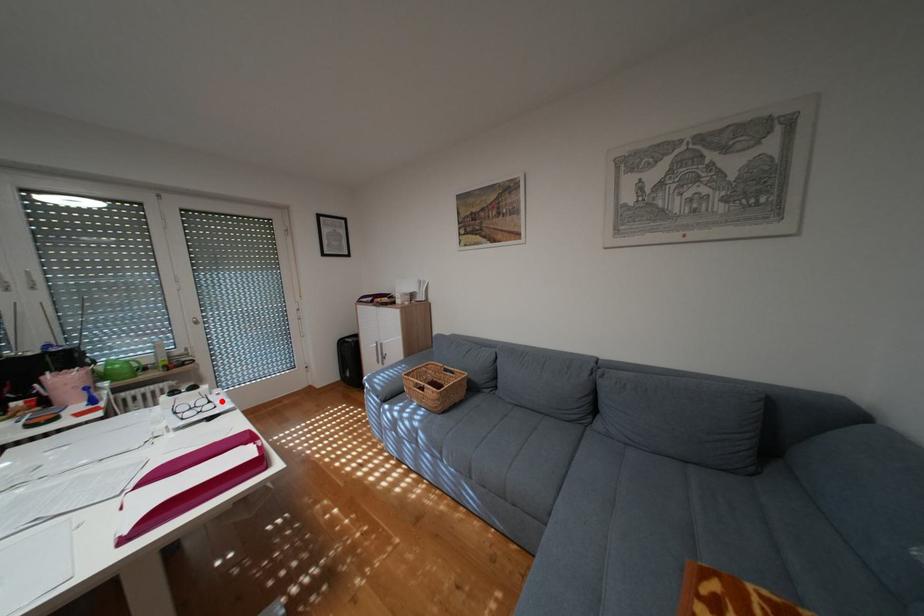
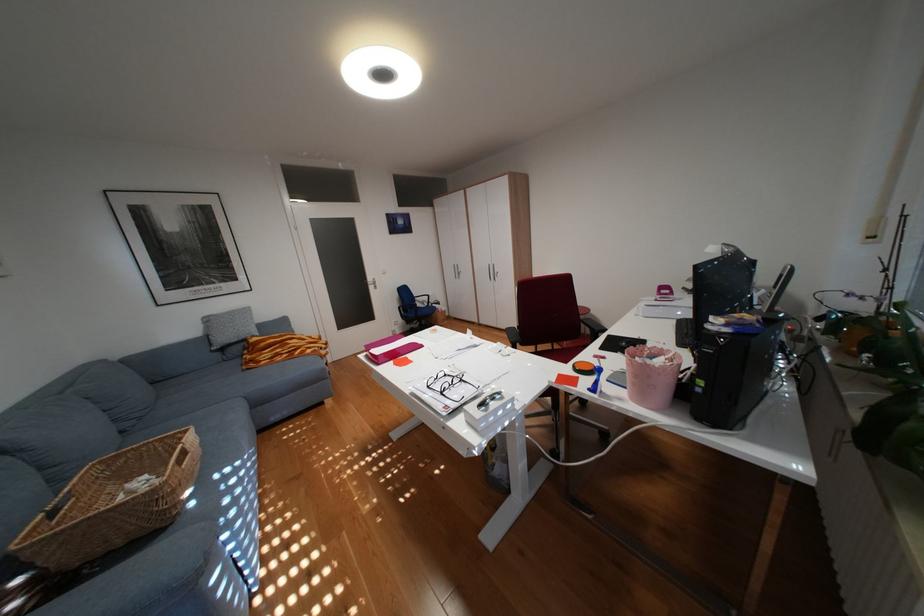
Question: I am providing you with two images of the same scene from different viewpoints. A red point is marked on the first image. Can you still see the location of the red point in image 2?

Choices:
 (A) Yes
 (B) No

Answer: (A)